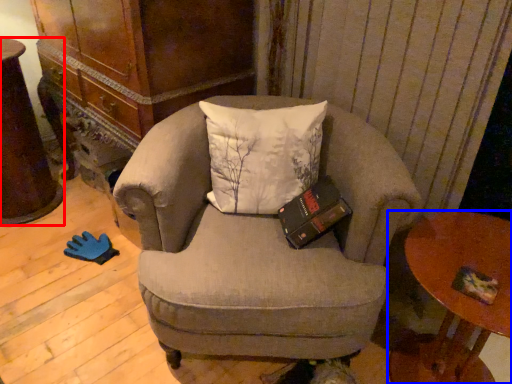
Question: Among these objects, which one is farthest to the camera, desk (highlighted by a red box) or table (highlighted by a blue box)?

Choices:
 (A) desk
 (B) table

Answer: (A)